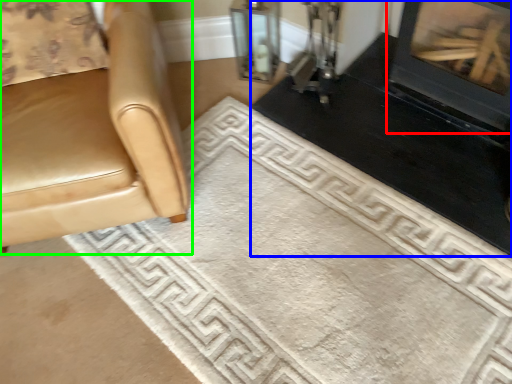
Question: Based on their relative distances, which object is farther from fireplace (highlighted by a red box)? Choose from fireplace (highlighted by a blue box) and chair (highlighted by a green box).

Choices:
 (A) fireplace
 (B) chair

Answer: (B)